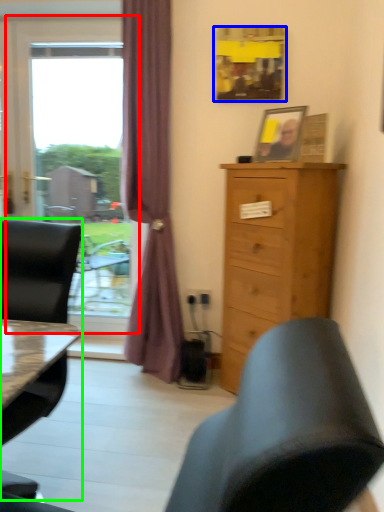
Question: Which is farther away from window (highlighted by a red box)? picture frame (highlighted by a blue box) or chair (highlighted by a green box)?

Choices:
 (A) picture frame
 (B) chair

Answer: (B)